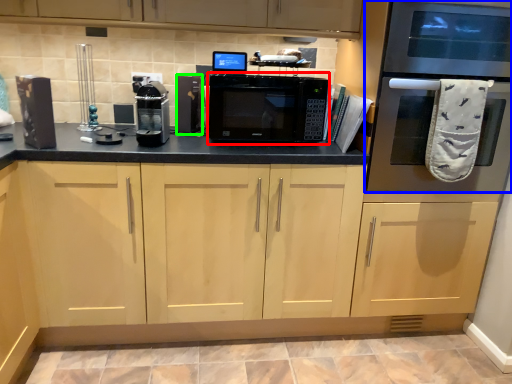
Question: Estimate the real-world distances between objects in this image. Which object is farther from microwave oven (highlighted by a red box), oven (highlighted by a blue box) or appliance (highlighted by a green box)?

Choices:
 (A) oven
 (B) appliance

Answer: (A)